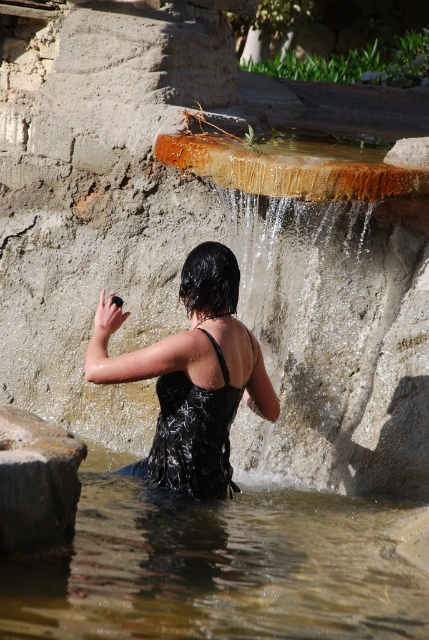
You are a photographer trying to capture the woman in the scene. Since the clear water at center and the wet black swimsuit at center are both at the center, which one is positioned lower?

The clear water at center is located below the wet black swimsuit at center, so the clear water at center is positioned lower.

You are a photographer positioned to capture the scene described. You notice the clear water at center and the wet black swimsuit at center. Which object is positioned closer to your camera lens?

The clear water at center is closer to the viewer than the wet black swimsuit at center, so the clear water at center would be closer to the camera lens.